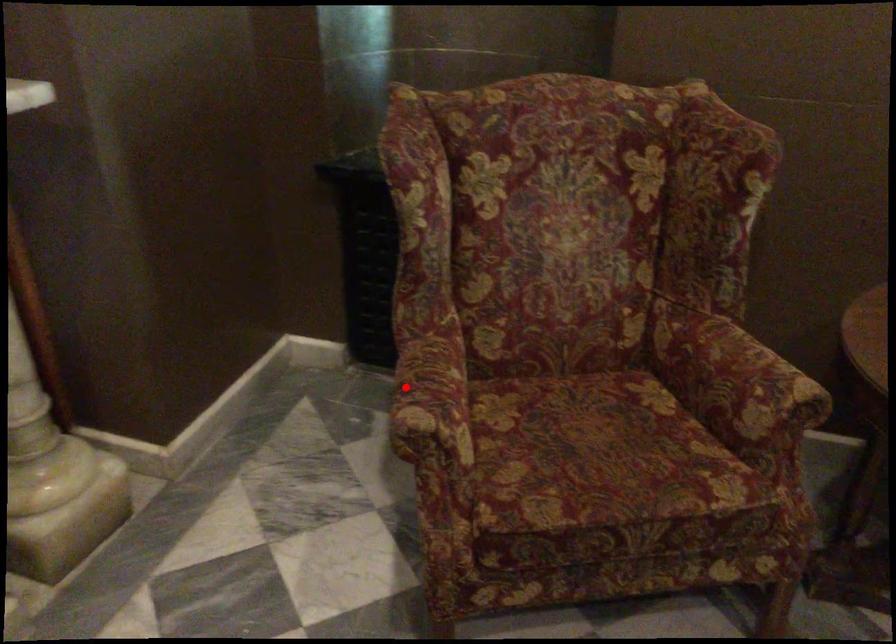
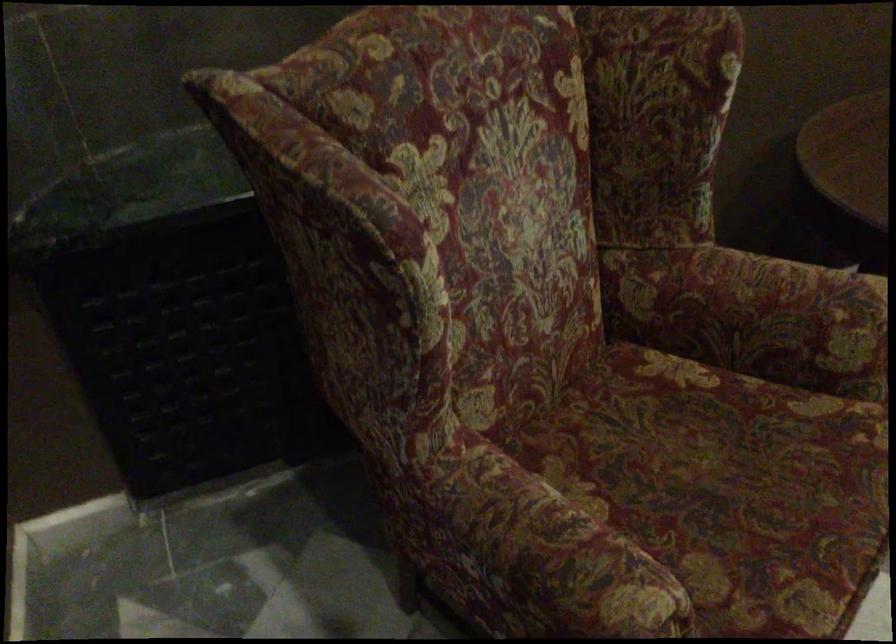
Locate, in the second image, the point that corresponds to the highlighted location in the first image.

(543, 559)